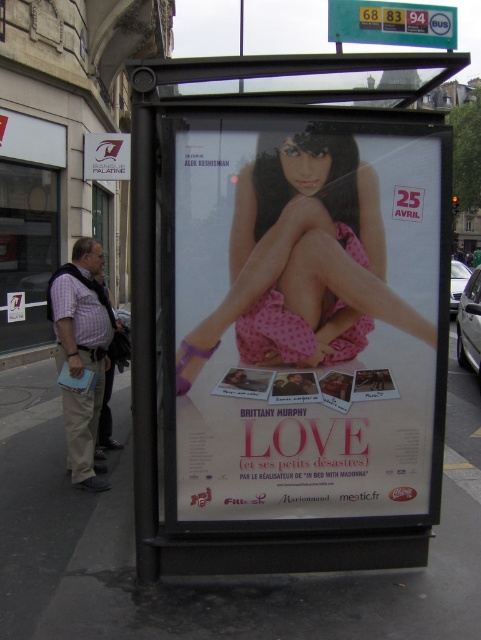
Is pink fabric poster at center further to the viewer compared to yellow/gold plastic bus stop sign at upper center?

No, it is not.

Is point (401, 492) behind point (370, 40)?

No, (401, 492) is closer to viewer.

Is point (391, 248) closer to camera compared to point (431, 28)?

Yes, point (391, 248) is closer to viewer.

Where is `pink fabric poster at center`? The width and height of the screenshot is (481, 640). pink fabric poster at center is located at coordinates point(305,323).

Does point (88, 596) come in front of point (339, 317)?

Yes.

What do you see at coordinates (206, 577) in the screenshot?
I see `smooth concrete pavement at lower center` at bounding box center [206, 577].

The image size is (481, 640). In order to click on smooth concrete pavement at lower center in this screenshot , I will do `click(206, 577)`.

In order to click on smooth concrete pavement at lower center in this screenshot , I will do `click(206, 577)`.

Who is shorter, pink polka dot dress at center or metallic silver sign at upper left?

pink polka dot dress at center

Does point (252, 189) lie behind point (117, 145)?

No.

I want to click on pink polka dot dress at center, so 253,209.